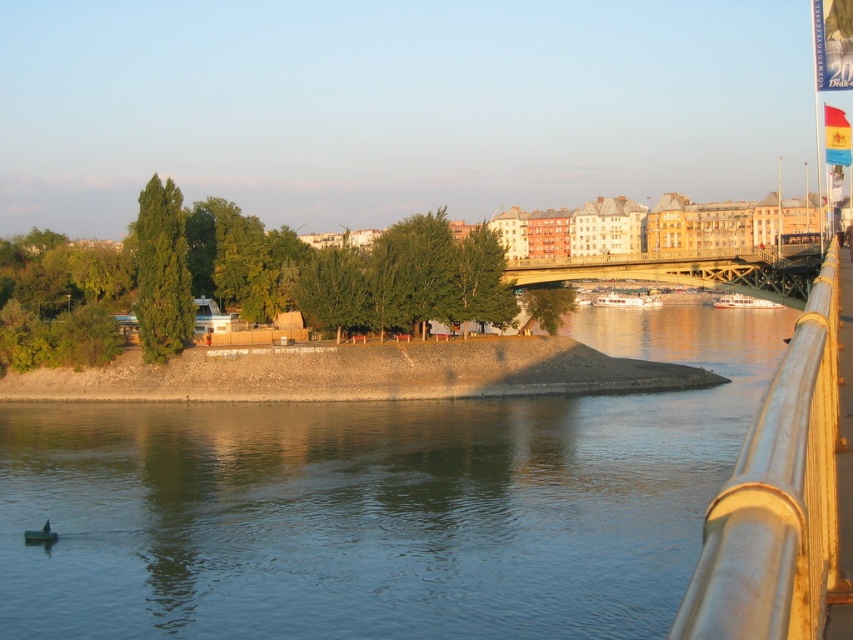
You are standing at the riverside and want to take a photo that includes both point (695,614) and point (531,275). Which point will appear larger in your photo?

Point (695,614) is closer to the camera than point (531,275), so it will appear larger in the photo.

You are standing at the center of the image and want to locate the metallic yellow railing at right. In terms of direction and distance, where should you look?

The metallic yellow railing at right is located at the coordinates point [779,499], so you should look to the right side of the image, closer to the bottom edge, to find it.